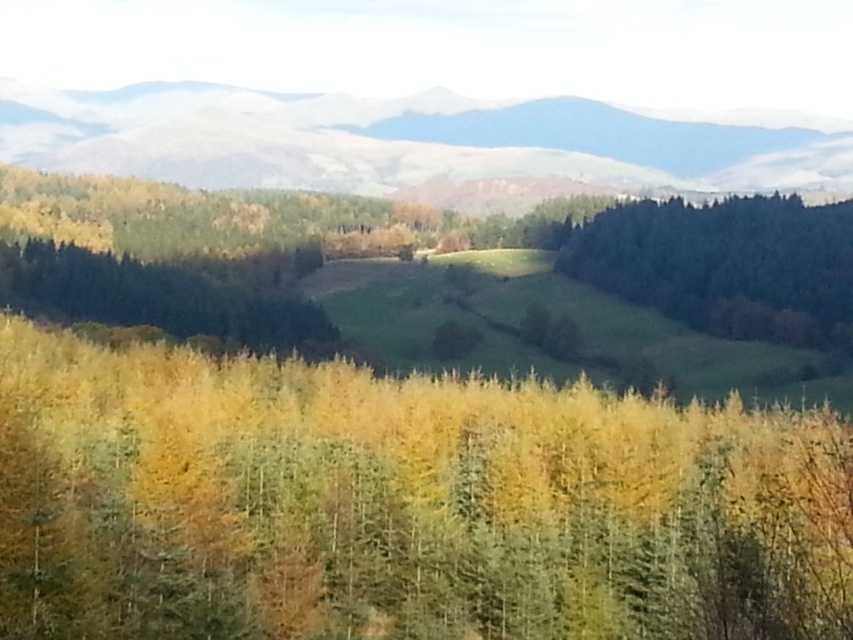
How far apart are snow-covered mountain at upper center and green matte trees at left?

snow-covered mountain at upper center and green matte trees at left are 146.06 meters apart.

Measure the distance between point (448, 100) and camera.

Point (448, 100) is 394.52 meters from camera.

Who is more distant from viewer, (476, 172) or (51, 298)?

The point (476, 172) is behind.

The image size is (853, 640). Identify the location of snow-covered mountain at upper center. (399, 141).

Is point (138, 172) farther from camera compared to point (683, 214)?

That is True.

Is snow-covered mountain at upper center positioned at the back of green matte tree at right?

Yes, snow-covered mountain at upper center is further from the viewer.

What do you see at coordinates (399, 141) in the screenshot?
I see `snow-covered mountain at upper center` at bounding box center [399, 141].

In order to click on snow-covered mountain at upper center in this screenshot , I will do `click(399, 141)`.

Between yellow-green foliage at center and green matte trees at left, which one appears on the left side from the viewer's perspective?

From the viewer's perspective, green matte trees at left appears more on the left side.

Can you confirm if yellow-green foliage at center is shorter than green matte trees at left?

No.

Find the location of a particular element. The image size is (853, 640). yellow-green foliage at center is located at coordinates (401, 502).

Image resolution: width=853 pixels, height=640 pixels. Find the location of `yellow-green foliage at center`. yellow-green foliage at center is located at coordinates (401, 502).